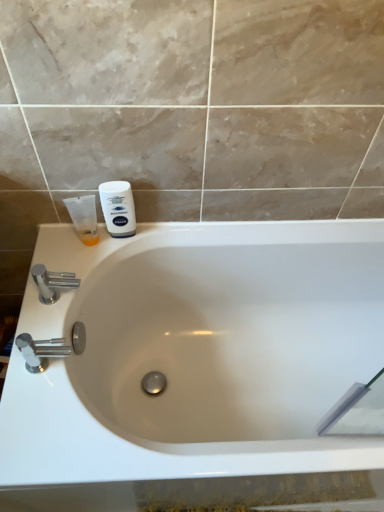
Question: Is the position of white matte shaving cream at upper left, the 2th shaving cream viewed from the left, more distant than that of translucent orange tube at left, which appears as the 1th shaving cream when viewed from the left?

Choices:
 (A) yes
 (B) no

Answer: (B)

Question: Could you tell me if white matte shaving cream at upper left, the 2th shaving cream viewed from the left, is turned towards translucent orange tube at left, which is the 2th shaving cream from right to left?

Choices:
 (A) no
 (B) yes

Answer: (A)

Question: Is white matte shaving cream at upper left, the 2th shaving cream viewed from the left, at the right side of translucent orange tube at left, which appears as the 1th shaving cream when viewed from the left?

Choices:
 (A) yes
 (B) no

Answer: (A)

Question: From a real-world perspective, is white matte shaving cream at upper left, arranged as the first shaving cream when viewed from the right, on translucent orange tube at left, which is the 2th shaving cream from right to left?

Choices:
 (A) no
 (B) yes

Answer: (B)

Question: Does white matte shaving cream at upper left, arranged as the first shaving cream when viewed from the right, have a lesser width compared to translucent orange tube at left, which is the 2th shaving cream from right to left?

Choices:
 (A) no
 (B) yes

Answer: (B)

Question: From the image's perspective, is white matte shaving cream at upper left, the 2th shaving cream viewed from the left, below translucent orange tube at left, which appears as the 1th shaving cream when viewed from the left?

Choices:
 (A) no
 (B) yes

Answer: (A)

Question: From a real-world perspective, is white matte shaving cream at upper left, arranged as the first shaving cream when viewed from the right, over chrome metallic faucet at left, the 1th tap in the top-to-bottom sequence?

Choices:
 (A) no
 (B) yes

Answer: (B)

Question: Considering the relative sizes of white matte shaving cream at upper left, arranged as the first shaving cream when viewed from the right, and chrome metallic faucet at left, the second tap viewed from the front, in the image provided, is white matte shaving cream at upper left, arranged as the first shaving cream when viewed from the right, smaller than chrome metallic faucet at left, the second tap viewed from the front,?

Choices:
 (A) no
 (B) yes

Answer: (B)

Question: Does white matte shaving cream at upper left, arranged as the first shaving cream when viewed from the right, have a lesser width compared to chrome metallic faucet at left, arranged as the 1th tap when viewed from the back?

Choices:
 (A) yes
 (B) no

Answer: (A)

Question: Considering the relative sizes of white matte shaving cream at upper left, arranged as the first shaving cream when viewed from the right, and chrome metallic faucet at left, the 1th tap in the top-to-bottom sequence, in the image provided, is white matte shaving cream at upper left, arranged as the first shaving cream when viewed from the right, taller than chrome metallic faucet at left, the 1th tap in the top-to-bottom sequence,?

Choices:
 (A) no
 (B) yes

Answer: (B)

Question: From the image's perspective, is white matte shaving cream at upper left, the 2th shaving cream viewed from the left, located beneath chrome metallic faucet at left, the 1th tap in the top-to-bottom sequence?

Choices:
 (A) yes
 (B) no

Answer: (B)

Question: Can you confirm if white matte shaving cream at upper left, the 2th shaving cream viewed from the left, is wider than chrome metallic faucet at left, arranged as the 1th tap when viewed from the back?

Choices:
 (A) yes
 (B) no

Answer: (B)

Question: Is polished chrome faucet at lower left, acting as the 2th tap starting from the top, a part of translucent orange tube at left, which appears as the 1th shaving cream when viewed from the left?

Choices:
 (A) no
 (B) yes

Answer: (A)